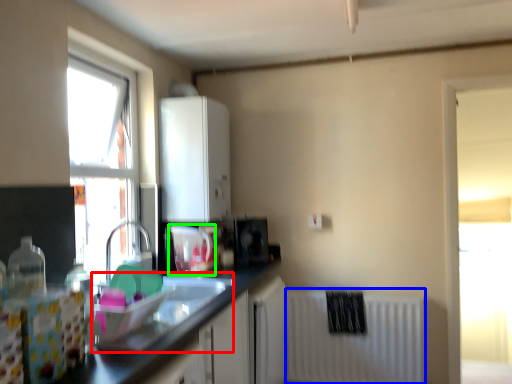
Question: Considering the real-world distances, which object is closest to sink (highlighted by a red box)? radiator (highlighted by a blue box) or appliance (highlighted by a green box).

Choices:
 (A) radiator
 (B) appliance

Answer: (B)